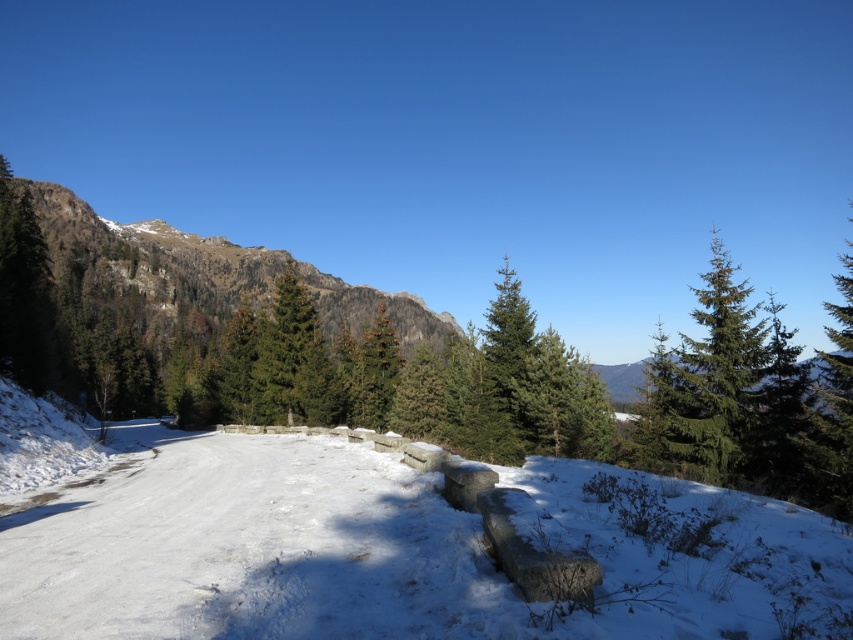
Question: Which object appears closest to the camera in this image?

Choices:
 (A) white snow at center
 (B) rugged stone mountain at left

Answer: (A)

Question: Is white snow at center thinner than rugged stone mountain at left?

Choices:
 (A) no
 (B) yes

Answer: (B)

Question: Which of the following is the closest to the observer?

Choices:
 (A) (83, 627)
 (B) (229, 244)
 (C) (494, 385)

Answer: (A)

Question: Based on their relative distances, which object is farther from the white snow at center?

Choices:
 (A) rugged stone mountain at left
 (B) green matte evergreen tree at center

Answer: (A)

Question: Where is white snow at center located in relation to rugged stone mountain at left in the image?

Choices:
 (A) below
 (B) above

Answer: (A)

Question: Does white snow at center appear on the left side of rugged stone mountain at left?

Choices:
 (A) yes
 (B) no

Answer: (B)